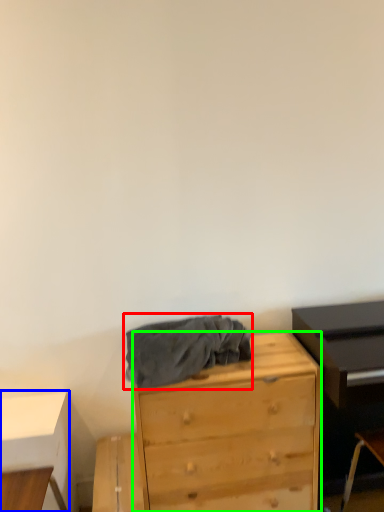
Question: Estimate the real-world distances between objects in this image. Which object is farther from clothing (highlighted by a red box), table (highlighted by a blue box) or chest of drawers (highlighted by a green box)?

Choices:
 (A) table
 (B) chest of drawers

Answer: (A)